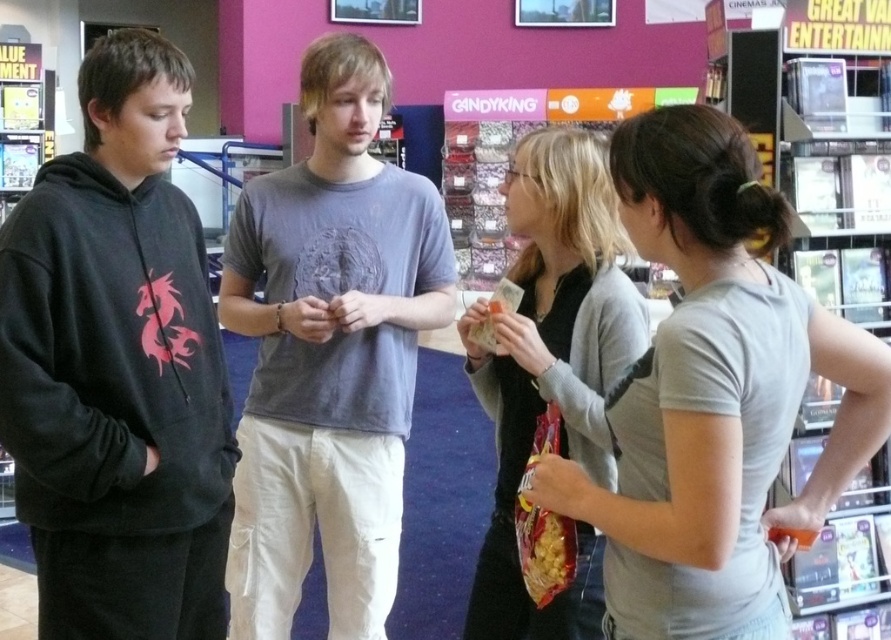
Question: Among these points, which one is farthest from the camera?

Choices:
 (A) (744, 291)
 (B) (51, 493)
 (C) (431, 291)
 (D) (636, 356)

Answer: (C)

Question: Observing the image, what is the correct spatial positioning of gray cotton t-shirt at center in reference to black matte cardigan at center?

Choices:
 (A) right
 (B) left

Answer: (B)

Question: Which object is positioned farthest from the gray matte t-shirt at center?

Choices:
 (A) black matte cardigan at center
 (B) gray cotton t-shirt at center
 (C) black hoodie at left

Answer: (C)

Question: Does gray matte t-shirt at center come in front of black matte cardigan at center?

Choices:
 (A) yes
 (B) no

Answer: (A)

Question: Which of the following is the farthest from the observer?

Choices:
 (A) black matte cardigan at center
 (B) gray cotton t-shirt at center
 (C) black hoodie at left

Answer: (B)

Question: Is black hoodie at left further to the viewer compared to gray matte t-shirt at center?

Choices:
 (A) no
 (B) yes

Answer: (B)